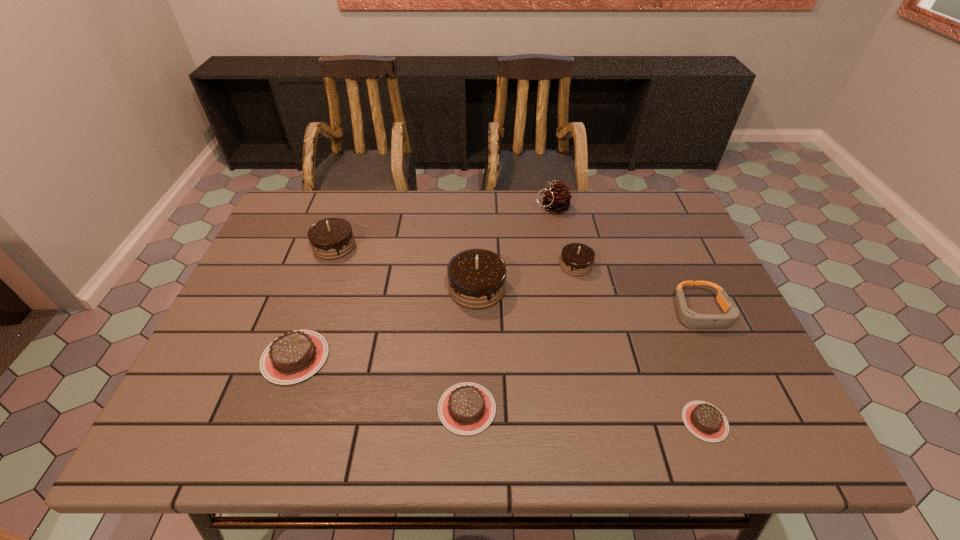
You are a GUI agent. You are given a task and a screenshot of the screen. Output one action in this format:
    pyautogui.click(x=<x>, y=<y>)
    Task: Click on the second chocolate chocolate cake from left to right
    
    Given the screenshot: What is the action you would take?
    pyautogui.click(x=476, y=277)

Find the location of a particular element. the biggest chocolate chocolate cake is located at coordinates tap(476, 277).

Identify the location of pinecone. (557, 199).

Identify the location of brown pinecone. The height and width of the screenshot is (540, 960). (557, 199).

Where is `the leftmost chocolate chocolate cake`? the leftmost chocolate chocolate cake is located at coordinates (332, 238).

The width and height of the screenshot is (960, 540). In order to click on the second biggest chocolate chocolate cake in this screenshot , I will do `click(332, 238)`.

You are a GUI agent. You are given a task and a screenshot of the screen. Output one action in this format:
    pyautogui.click(x=<x>, y=<y>)
    Task: Click on the smallest chocolate chocolate cake
    
    Given the screenshot: What is the action you would take?
    pyautogui.click(x=577, y=259)

The height and width of the screenshot is (540, 960). I want to click on the fourth tallest object, so click(577, 259).

At what (x,y) coordinates should I click in order to perform the action: click on the fourth shortest object. Please return your answer as a coordinate pair (x, y). The width and height of the screenshot is (960, 540). Looking at the image, I should click on (689, 318).

Where is `the fourth tallest chocolate cake`? The height and width of the screenshot is (540, 960). the fourth tallest chocolate cake is located at coordinates (293, 357).